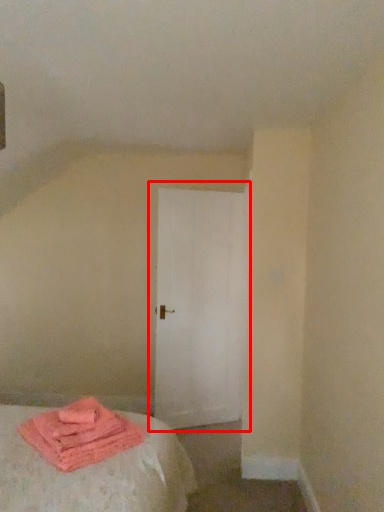
Question: From the image's perspective, what is the correct spatial positioning of door (annotated by the red box) in reference to material?

Choices:
 (A) below
 (B) above

Answer: (B)